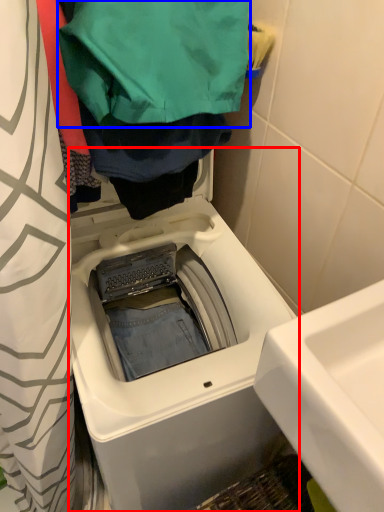
Question: Which object is further to the camera taking this photo, washing machine (highlighted by a red box) or clothing (highlighted by a blue box)?

Choices:
 (A) washing machine
 (B) clothing

Answer: (A)